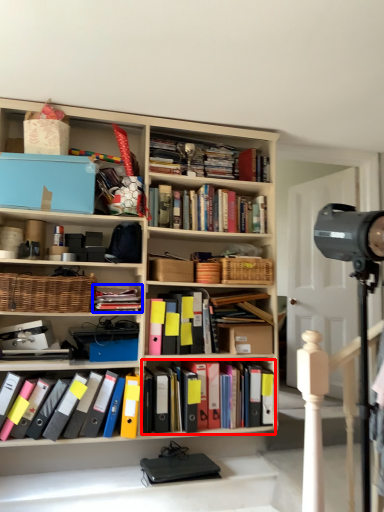
Question: Which of the following is the farthest to the observer, book (highlighted by a red box) or book (highlighted by a blue box)?

Choices:
 (A) book
 (B) book

Answer: (A)